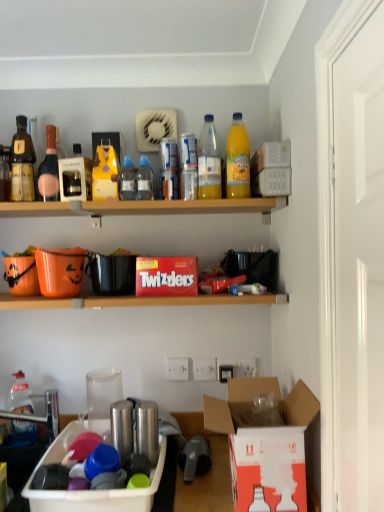
Question: Is transparent plastic bottle at upper center, which is counted as the 2th bottle, starting from the bottom, to the left or to the right of red cardboard twizzlers at center, which ranks as the 2th box in right-to-left order, in the image?

Choices:
 (A) right
 (B) left

Answer: (B)

Question: Is transparent plastic bottle at upper center, which ranks as the fifth bottle in top-to-bottom order, taller or shorter than red cardboard twizzlers at center, the 1th box from the top?

Choices:
 (A) short
 (B) tall

Answer: (B)

Question: Considering the real-world distances, which object is farthest from the matte glass bottle at upper left, the second bottle in the left-to-right sequence?

Choices:
 (A) white cardboard box at lower right, which appears as the 3th box when viewed from the left
 (B) transparent plastic bottle at upper center, which is counted as the 2th bottle, starting from the bottom
 (C) translucent plastic bottle at upper center, positioned as the 4th bottle in left-to-right order
 (D) transparent plastic straw at upper center
 (E) red cardboard twizzlers at center, acting as the 3th box starting from the bottom

Answer: (A)

Question: Which object is the closest to the transparent plastic bottle at center, the fifth bottle in the bottom-to-top sequence?

Choices:
 (A) white glossy door at upper right
 (B) translucent plastic bottle at upper center, acting as the third bottle starting from the bottom
 (C) translucent plastic bottle at lower left, the sixth bottle viewed from the right
 (D) black matte coffee cup at center, placed as the first coffee cup when sorted from top to bottom
 (E) orange matte plastic bucket at left

Answer: (B)